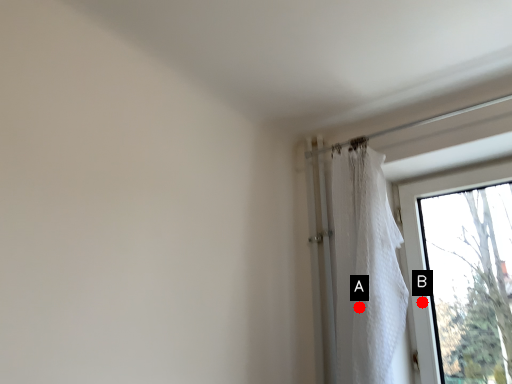
Question: Two points are circled on the image, labeled by A and B beside each circle. Which point appears closest to the camera in this image?

Choices:
 (A) A is closer
 (B) B is closer

Answer: (A)